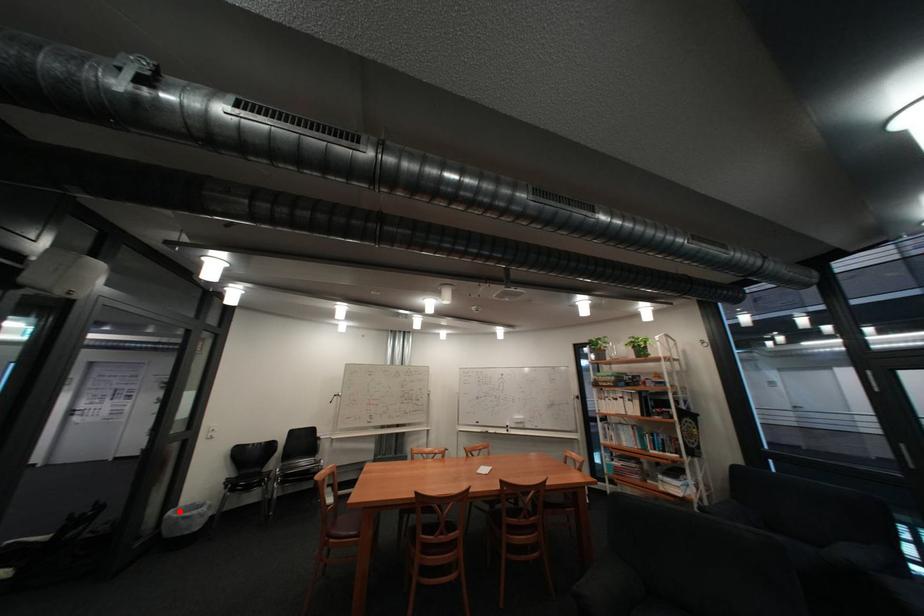
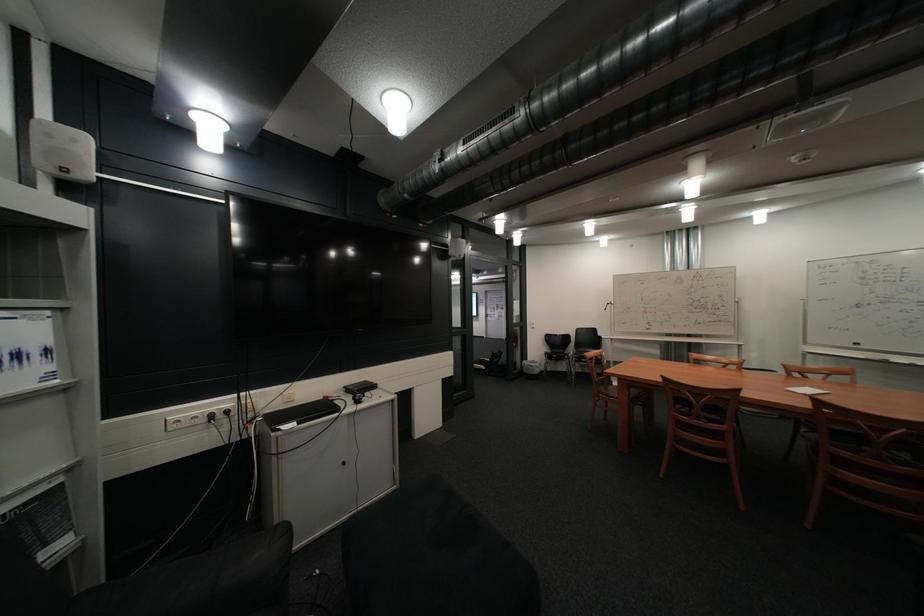
The point at the highlighted location is marked in the first image. Where is the corresponding point in the second image?

(537, 361)